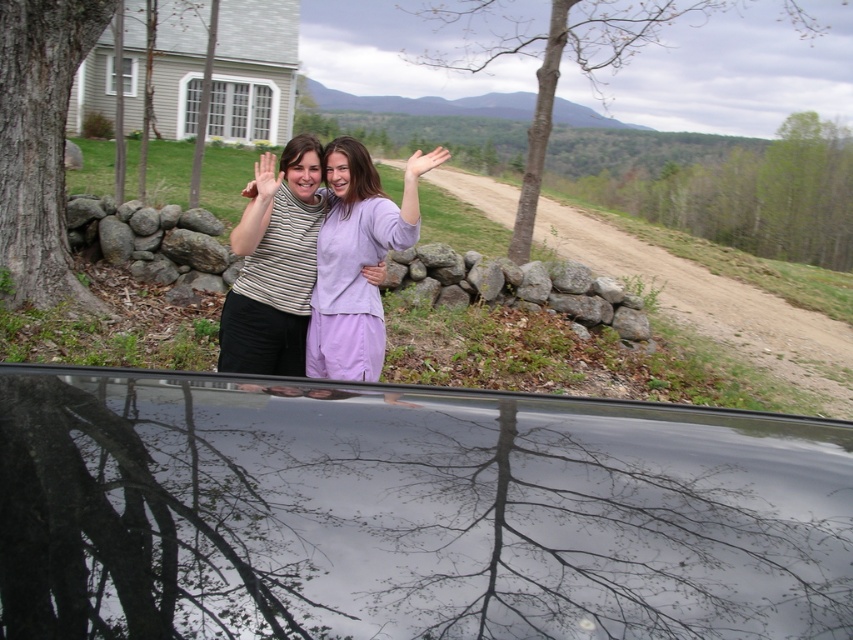
Question: Considering the real-world distances, which object is closest to the matte purple hand at upper center?

Choices:
 (A) bare branches at upper center
 (B) smooth gray bark at left
 (C) glossy black car window at center

Answer: (C)

Question: Which object appears closest to the camera in this image?

Choices:
 (A) smooth gray bark at left
 (B) bare branches at upper center
 (C) matte black hand at upper center

Answer: (C)

Question: Is glossy black car window at center below smooth gray bark at left?

Choices:
 (A) yes
 (B) no

Answer: (A)

Question: Is matte purple dress at center smaller than matte purple hand at upper center?

Choices:
 (A) yes
 (B) no

Answer: (A)

Question: Which point is farther to the camera?

Choices:
 (A) matte purple dress at center
 (B) glossy black car window at center
 (C) matte purple hand at upper center

Answer: (C)

Question: Observing the image, what is the correct spatial positioning of bare branches at upper center in reference to matte black hand at upper center?

Choices:
 (A) left
 (B) right

Answer: (B)